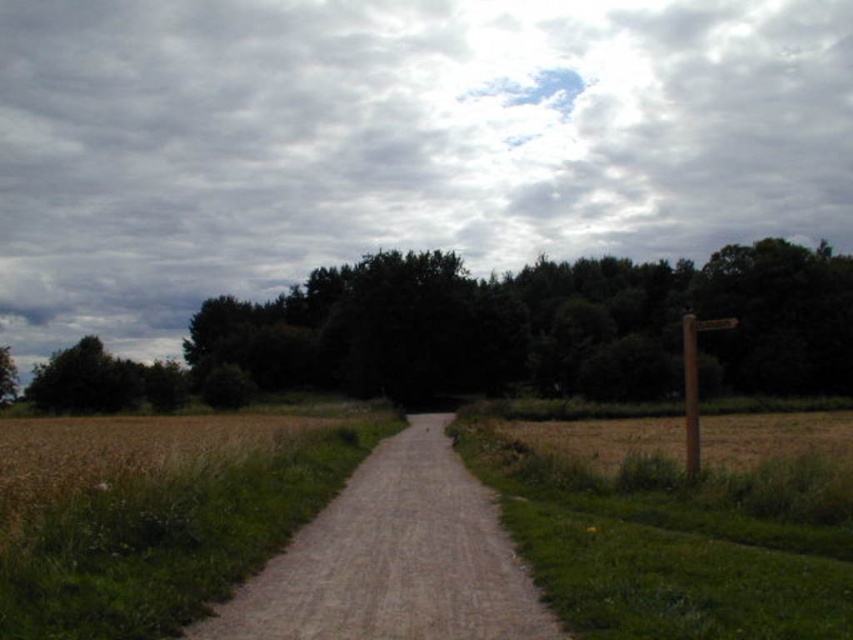
From the picture: Is cloudy sky at upper center bigger than green leafy tree at upper center?

Indeed, cloudy sky at upper center has a larger size compared to green leafy tree at upper center.

The height and width of the screenshot is (640, 853). What do you see at coordinates (393, 141) in the screenshot?
I see `cloudy sky at upper center` at bounding box center [393, 141].

Who is more forward, (241, 68) or (642, 262)?

Point (241, 68) is more forward.

You are a GUI agent. You are given a task and a screenshot of the screen. Output one action in this format:
    pyautogui.click(x=<x>, y=<y>)
    Task: Click on the cloudy sky at upper center
    This screenshot has width=853, height=640.
    Given the screenshot: What is the action you would take?
    pyautogui.click(x=393, y=141)

Does point (270, 196) come farther from viewer compared to point (230, 600)?

That is True.

The width and height of the screenshot is (853, 640). I want to click on cloudy sky at upper center, so click(x=393, y=141).

Is green leafy tree at upper center closer to camera compared to dirt/gravel path at center?

No, green leafy tree at upper center is behind dirt/gravel path at center.

Does green leafy tree at upper center appear over dirt/gravel path at center?

Correct, green leafy tree at upper center is located above dirt/gravel path at center.

Which is behind, point (410, 387) or point (370, 557)?

The point (410, 387) is behind.

Locate an element on the screen. This screenshot has height=640, width=853. green leafy tree at upper center is located at coordinates (541, 324).